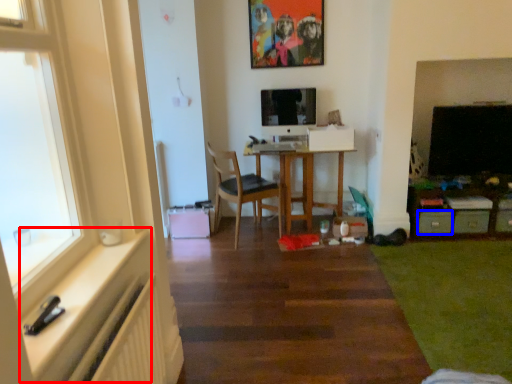
Question: Among these objects, which one is nearest to the camera, window sill (highlighted by a red box) or drawer (highlighted by a blue box)?

Choices:
 (A) window sill
 (B) drawer

Answer: (A)